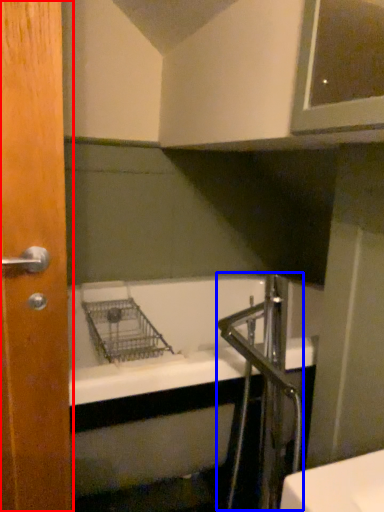
Question: Which point is further to the camera, door (highlighted by a red box) or faucet (highlighted by a blue box)?

Choices:
 (A) door
 (B) faucet

Answer: (B)